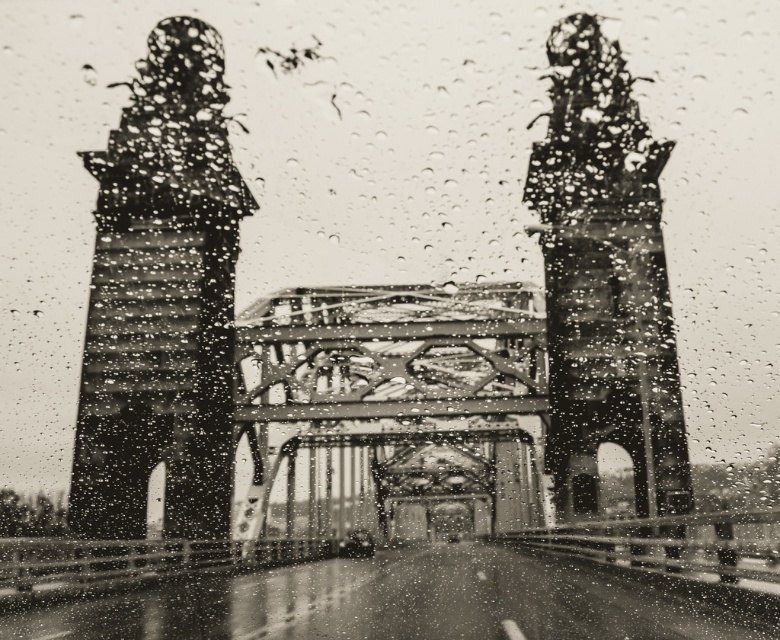
You are inside a car and looking through the rain streaked window. You see a point at coordinates [392,410]. What object does this point correspond to?

The point at coordinates [392,410] corresponds to the metallic bridge at center.

You are a passenger in a car driving under a bridge with two towers. The scene includes a rusty metal tower at left and a rusty metal bell tower at center. From your perspective inside the car, which tower is positioned higher in the view?

The rusty metal tower at left is positioned higher than the rusty metal bell tower at center in the view.